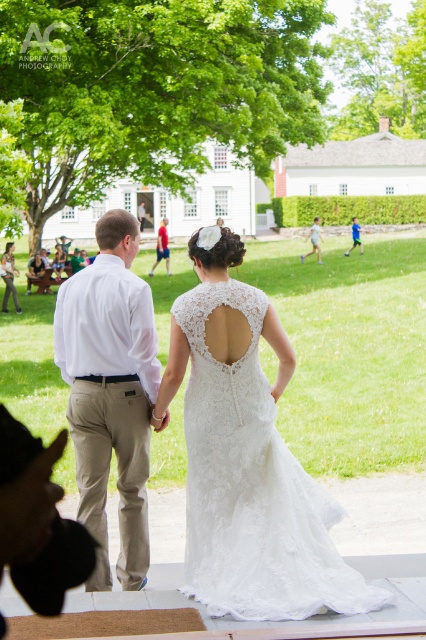
You are standing at the point labeled point (249, 492) and want to walk towards the point labeled point (25, 280). Which direction should you face to move directly towards it?

Since point (249, 492) is closer to the viewer than point (25, 280), you should face downwards to move directly towards it.